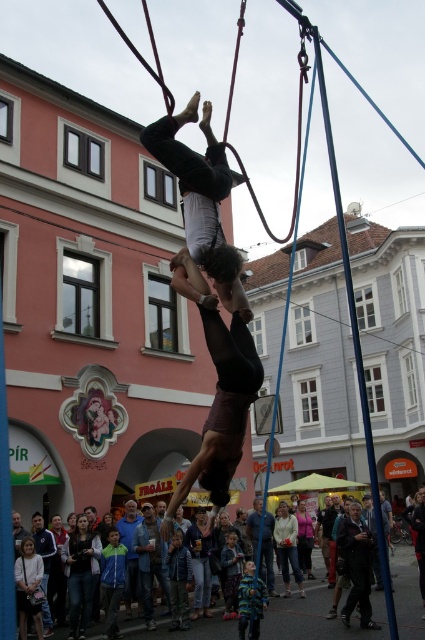
You are an observer standing in front of the pink building with white trim. You see two sweaters, the dark gray sweater at lower left and the light beige sweater at center. Which one is taller?

The dark gray sweater at lower left is taller than the light beige sweater at center.

You are a photographer trying to capture the acrobats in the image. You notice the light beige sweater at center and the blue denim jeans at center. Which clothing item is positioned to the right side?

The light beige sweater at center is to the right of the blue denim jeans at center.